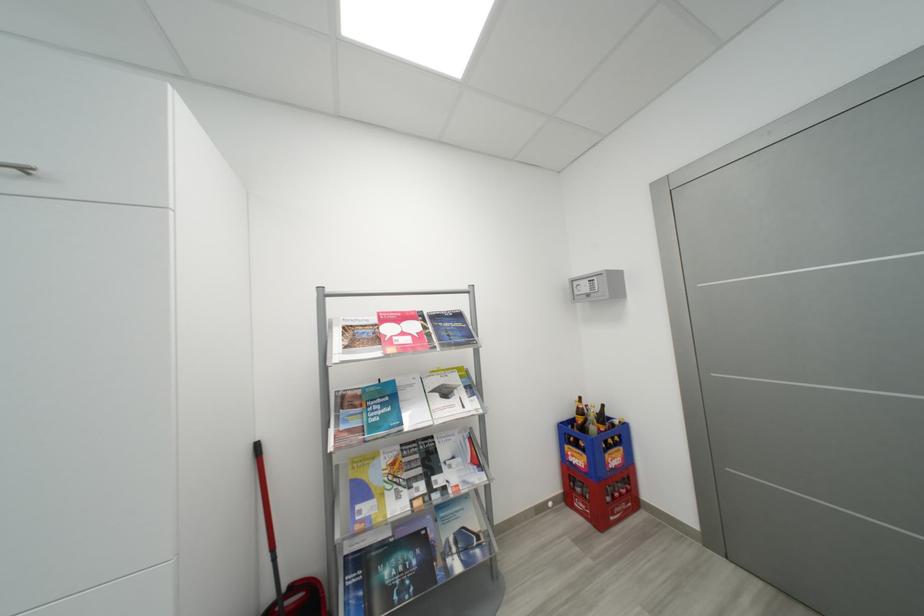
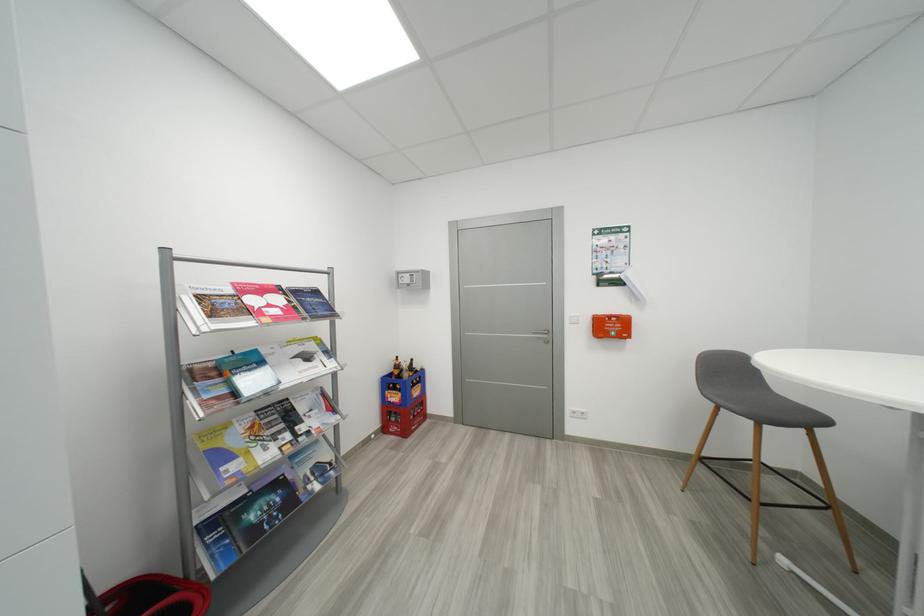
Locate, in the second image, the point that corresponds to (x=592, y=421) in the first image.

(408, 371)